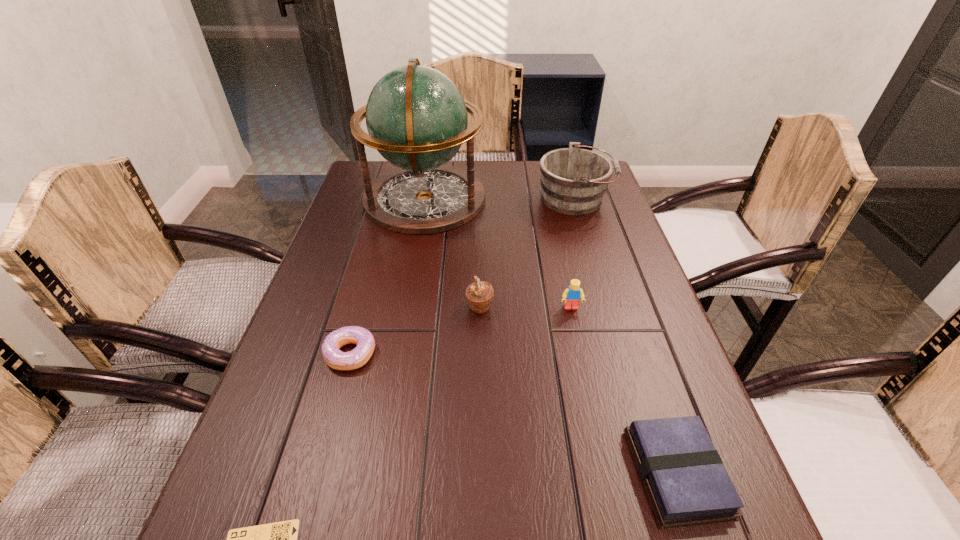
The width and height of the screenshot is (960, 540). What are the coordinates of `the tallest object` in the screenshot? It's located at (416, 117).

This screenshot has height=540, width=960. What are the coordinates of `wine bucket` in the screenshot? It's located at (573, 180).

At what (x,y) coordinates should I click in order to perform the action: click on muffin. Please return your answer as a coordinate pair (x, y). The image size is (960, 540). Looking at the image, I should click on (479, 294).

You are a GUI agent. You are given a task and a screenshot of the screen. Output one action in this format:
    pyautogui.click(x=<x>, y=<y>)
    Task: Click on the Lego
    
    Given the screenshot: What is the action you would take?
    pyautogui.click(x=572, y=295)

Identify the location of the third nearest object. The height and width of the screenshot is (540, 960). tap(359, 356).

The width and height of the screenshot is (960, 540). I want to click on book, so click(x=687, y=483).

You are a GUI agent. You are given a task and a screenshot of the screen. Output one action in this format:
    pyautogui.click(x=<x>, y=<y>)
    Task: Click on the free space located on the front-facing side of the tallest object
    The width and height of the screenshot is (960, 540).
    Given the screenshot: What is the action you would take?
    pyautogui.click(x=606, y=199)

At what (x,y) coordinates should I click in order to perform the action: click on vacant region located 0.080m on the back of the wine bucket. Please return your answer as a coordinate pair (x, y). The image size is (960, 540). Looking at the image, I should click on (565, 169).

Locate an element on the screen. vacant area situated 0.090m on the left of the muffin is located at coordinates (427, 307).

You are a GUI agent. You are given a task and a screenshot of the screen. Output one action in this format:
    pyautogui.click(x=<x>, y=<y>)
    Task: Click on the vacant space located on the front-facing side of the Lego
    
    Given the screenshot: What is the action you would take?
    pyautogui.click(x=595, y=422)